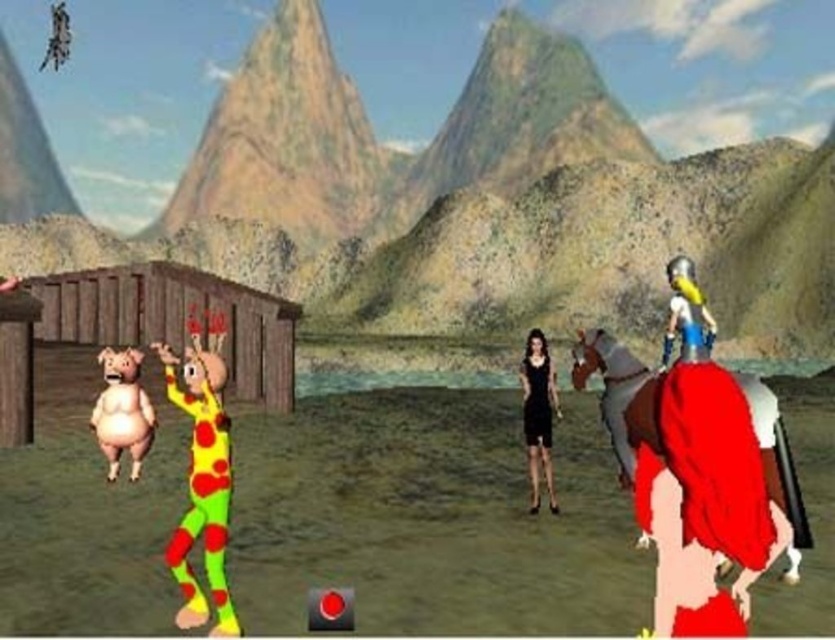
Question: Observing the image, what is the correct spatial positioning of green polka dot onesie at center left in reference to shiny silver helmet at upper right?

Choices:
 (A) right
 (B) left

Answer: (B)

Question: Which object appears farthest from the camera in this image?

Choices:
 (A) black satin dress at center
 (B) shiny silver helmet at upper right

Answer: (A)

Question: Can you confirm if shiny red cape at right is thinner than pink rubber pig at left?

Choices:
 (A) no
 (B) yes

Answer: (A)

Question: Which of the following is the closest to the observer?

Choices:
 (A) (530, 356)
 (B) (171, 284)

Answer: (A)

Question: Can you confirm if shiny red cape at right is thinner than pink rubber pig at left?

Choices:
 (A) yes
 (B) no

Answer: (B)

Question: Which object is closer to the camera taking this photo?

Choices:
 (A) wooden hut at left
 (B) shiny red cape at right

Answer: (B)